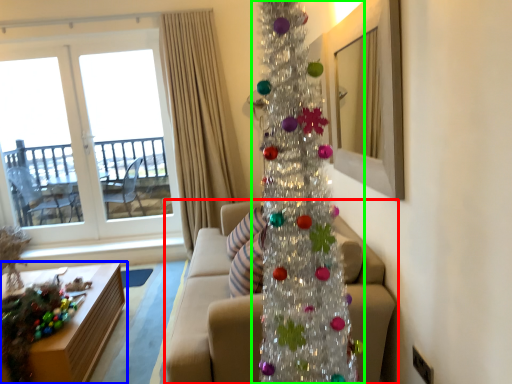
Question: Which object is the farthest from studio couch (highlighted by a red box)? Choose among these: table (highlighted by a blue box) or christmas tree (highlighted by a green box).

Choices:
 (A) table
 (B) christmas tree

Answer: (A)